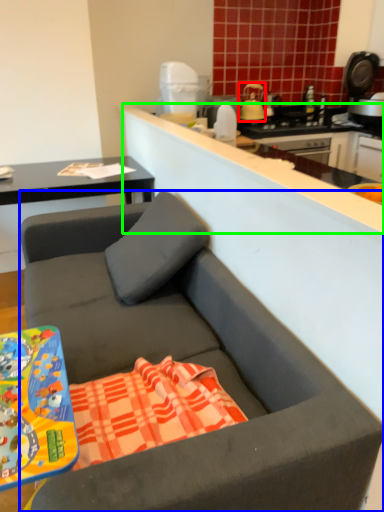
Question: Estimate the real-world distances between objects in this image. Which object is closer to kitchen appliance (highlighted by a red box), studio couch (highlighted by a blue box) or counter top (highlighted by a green box)?

Choices:
 (A) studio couch
 (B) counter top

Answer: (B)